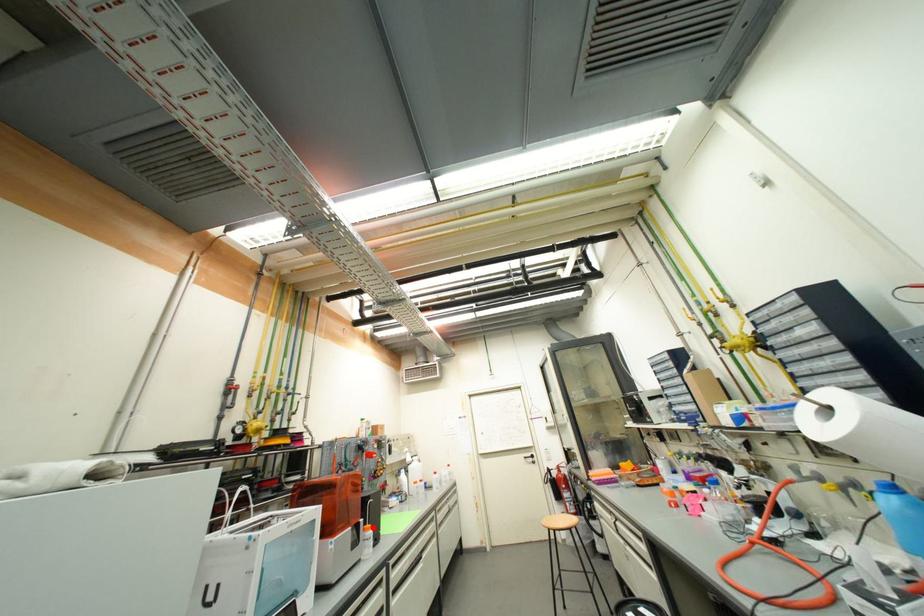
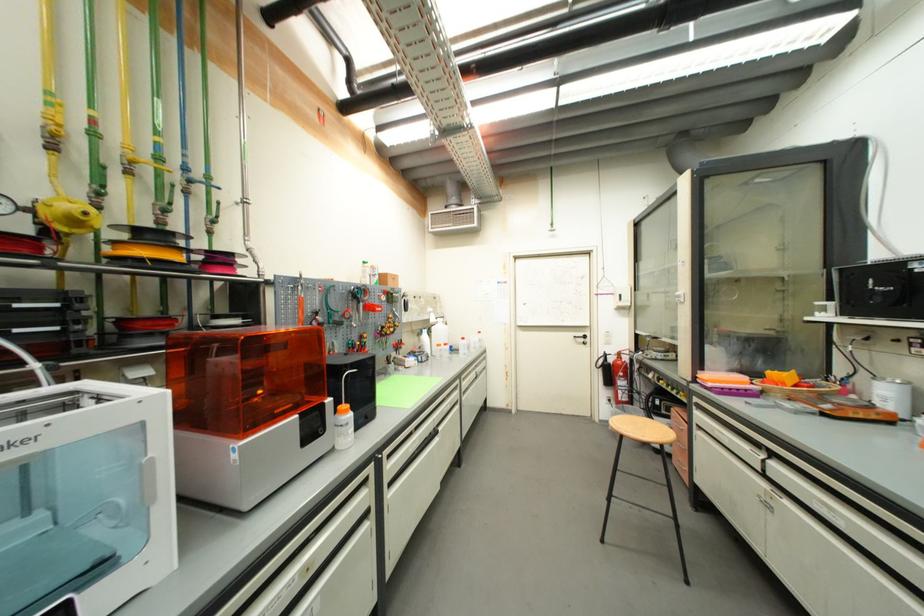
Locate, in the second image, the point that corresponds to the highlighted location in the first image.

(349, 408)